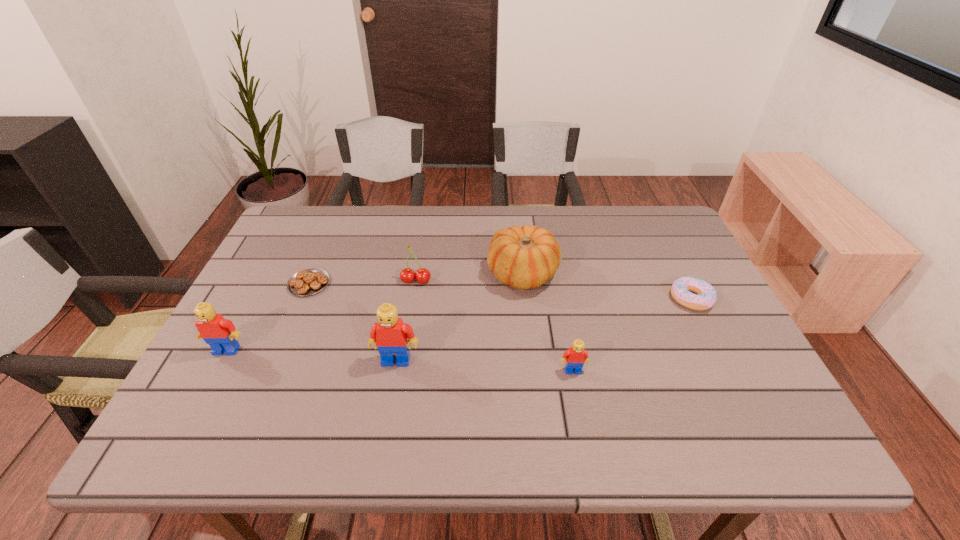
You are a GUI agent. You are given a task and a screenshot of the screen. Output one action in this format:
    pyautogui.click(x=<x>, y=<y>)
    Task: Click on the sixth shortest object
    This screenshot has height=540, width=960.
    Given the screenshot: What is the action you would take?
    pyautogui.click(x=221, y=335)

Locate an element on the screen. the second tallest Lego is located at coordinates (221, 335).

This screenshot has width=960, height=540. Identify the location of the second Lego from left to right. (391, 336).

You are a GUI agent. You are given a task and a screenshot of the screen. Output one action in this format:
    pyautogui.click(x=<x>, y=<y>)
    Task: Click on the shortest Lego
    The image size is (960, 540).
    Given the screenshot: What is the action you would take?
    pyautogui.click(x=576, y=356)

Locate an element on the screen. This screenshot has width=960, height=540. the second shortest object is located at coordinates (680, 290).

Where is `doughnut`? doughnut is located at coordinates (680, 290).

Where is `gourd`? This screenshot has height=540, width=960. gourd is located at coordinates (526, 257).

This screenshot has width=960, height=540. In order to click on cherry in this screenshot , I will do `click(407, 275)`.

The image size is (960, 540). Find the location of `pastry`. pastry is located at coordinates (310, 281).

You are a GUI agent. You are given a task and a screenshot of the screen. Output one action in this format:
    pyautogui.click(x=<x>, y=<y>)
    Task: Click on the sixth object from right to left
    This screenshot has height=540, width=960.
    Given the screenshot: What is the action you would take?
    pyautogui.click(x=310, y=281)